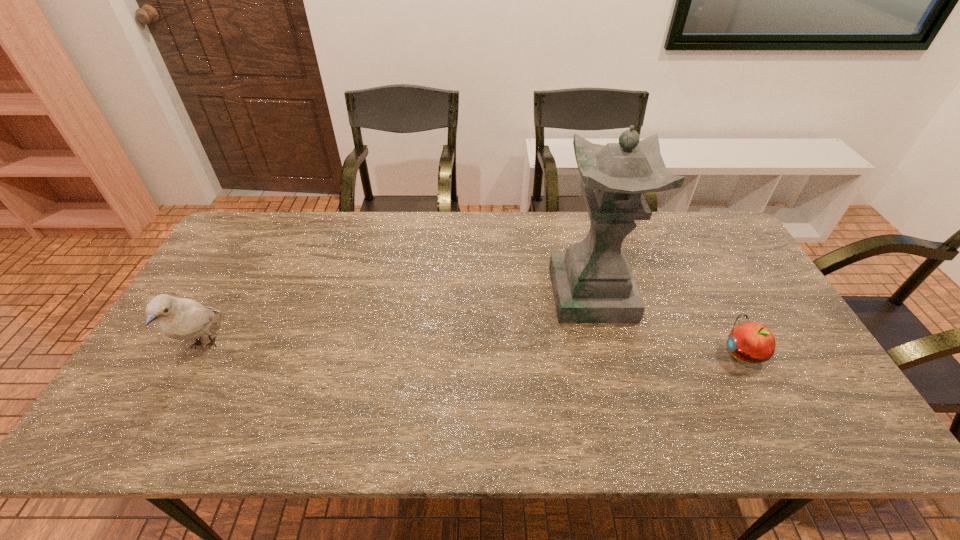
Locate an element on the screen. This screenshot has width=960, height=540. blank space located 0.160m on the front of the shortest object is located at coordinates (784, 433).

Locate an element on the screen. object situated at the left edge is located at coordinates (178, 318).

Where is `object that is at the right edge`? The height and width of the screenshot is (540, 960). object that is at the right edge is located at coordinates (751, 342).

This screenshot has width=960, height=540. In the image, there is a desktop. In order to click on free space at the far edge in this screenshot , I will do `click(571, 218)`.

In the image, there is a desktop. Where is `vacant space at the near edge`? vacant space at the near edge is located at coordinates (233, 437).

Where is `free location at the left edge of the desktop`? The height and width of the screenshot is (540, 960). free location at the left edge of the desktop is located at coordinates [219, 334].

Locate an element on the screen. free space at the right edge of the desktop is located at coordinates (799, 348).

You are a GUI agent. You are given a task and a screenshot of the screen. Output one action in this format:
    pyautogui.click(x=<x>, y=<y>)
    Task: Click on the vacant space at the far left corner of the desktop
    The width and height of the screenshot is (960, 540).
    Given the screenshot: What is the action you would take?
    pyautogui.click(x=245, y=250)

The width and height of the screenshot is (960, 540). Identify the location of free space at the near right corner. (819, 418).

Identify the location of free space between the shortest object and the sculpture. (667, 324).